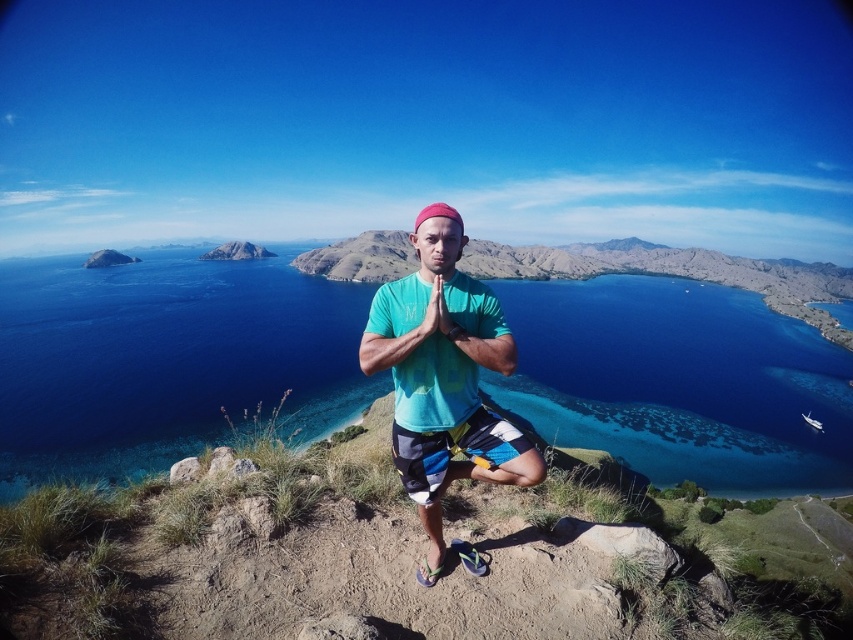
You are a photographer trying to capture a photo of the striped cotton shorts at center and the blue water at center. Which object is located to the left of the other?

The blue water at center is positioned on the left side of striped cotton shorts at center.

Based on the photo, you are a photographer planning to take a landscape photo of the scene. The blue water at center and striped cotton shorts at center are both in the frame. Which object appears taller in the photo?

The blue water at center appears taller than the striped cotton shorts at center in the photo because the blue water at center has a greater height compared to striped cotton shorts at center.